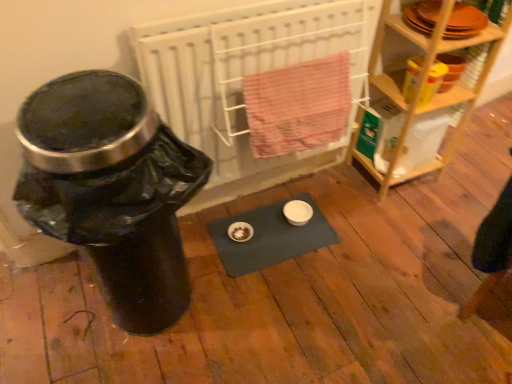
You are a GUI agent. You are given a task and a screenshot of the screen. Output one action in this format:
    pyautogui.click(x=<x>, y=<y>)
    Task: Click on the free region on the left part of black plastic water cooler at left
    The width and height of the screenshot is (512, 384).
    Given the screenshot: What is the action you would take?
    pyautogui.click(x=45, y=311)